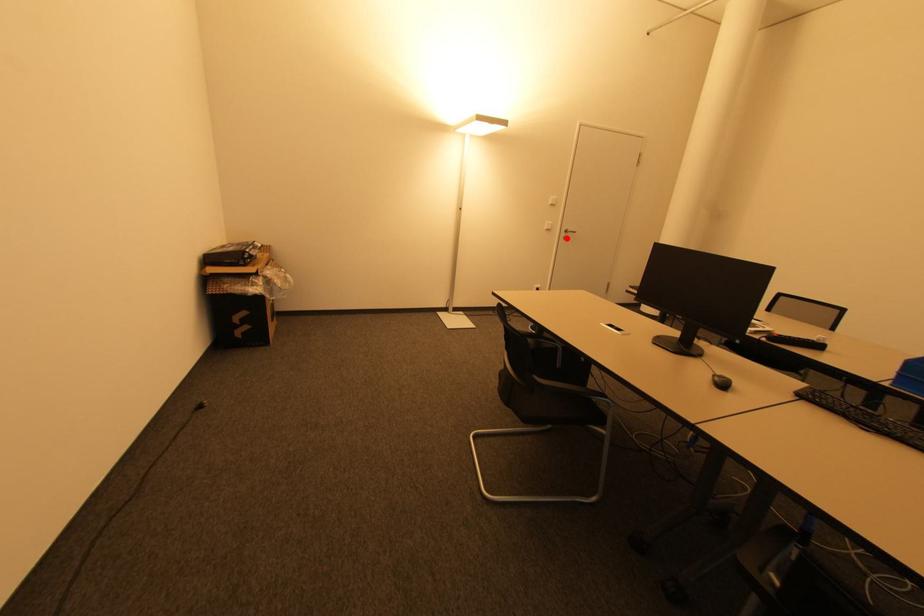
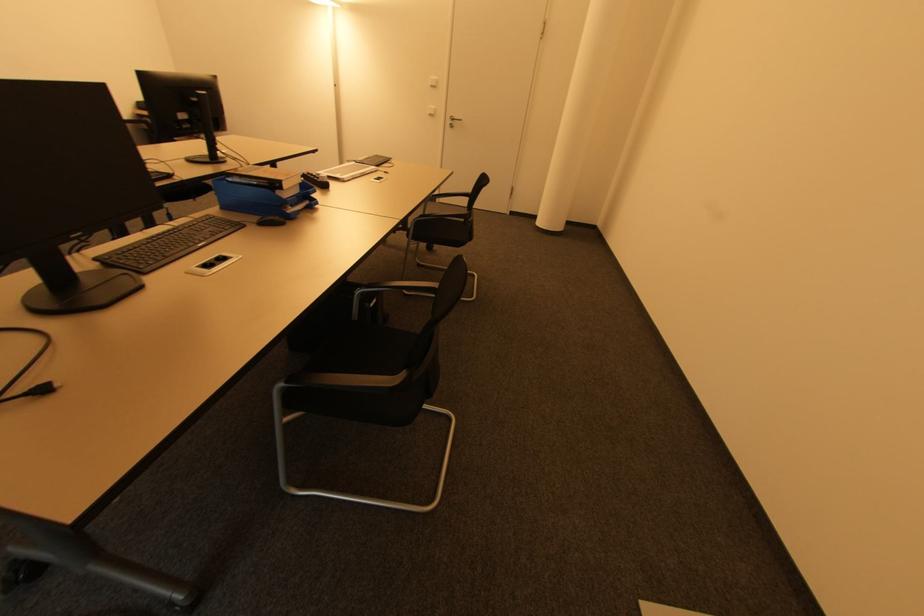
Question: I am providing you with two images of the same scene from different viewpoints. Image1 has a red point marked. In image2, the corresponding 3D location appears at what relative position? Reply with the corresponding letter.

Choices:
 (A) Closer
 (B) Farther

Answer: (A)